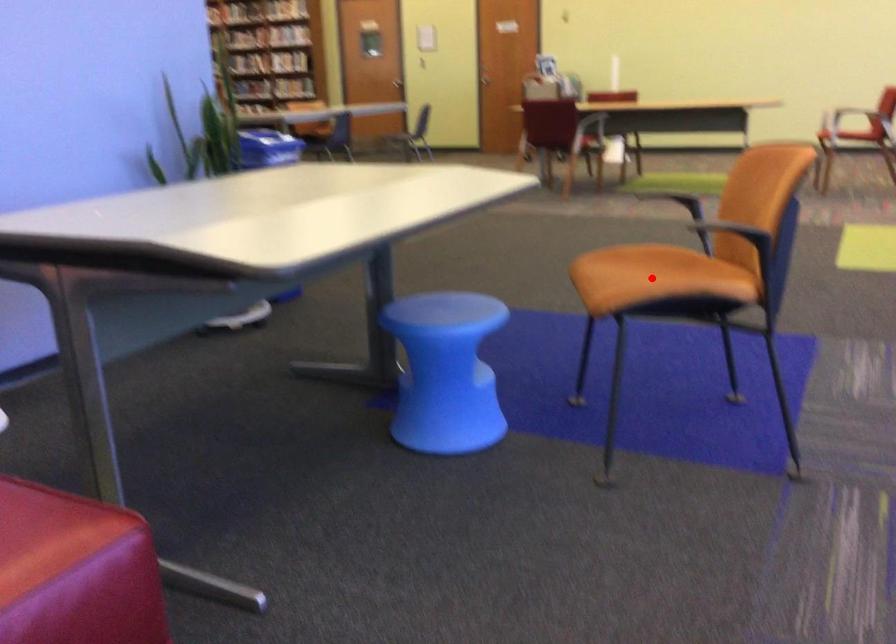
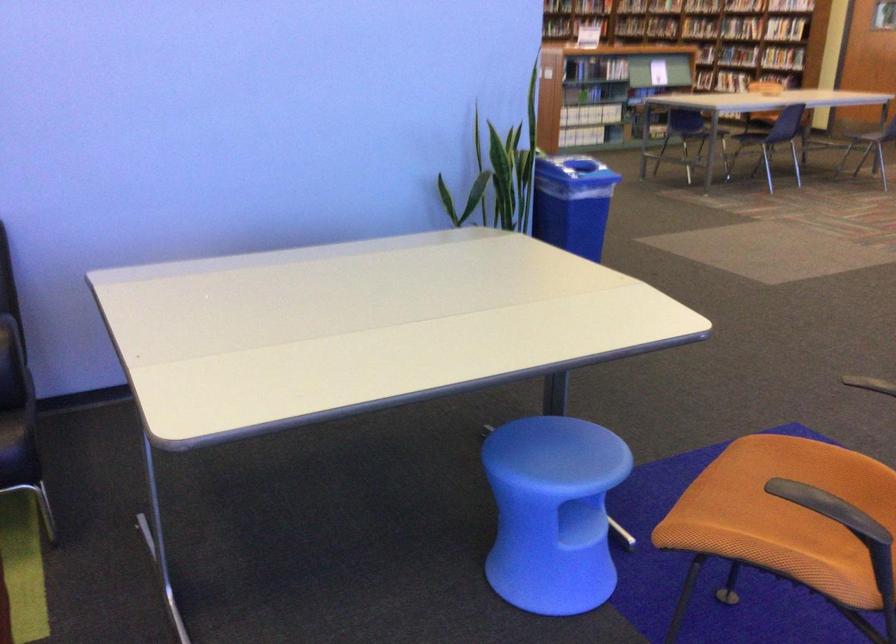
Where in the second image is the point corresponding to the highlighted location from the first image?

(785, 503)